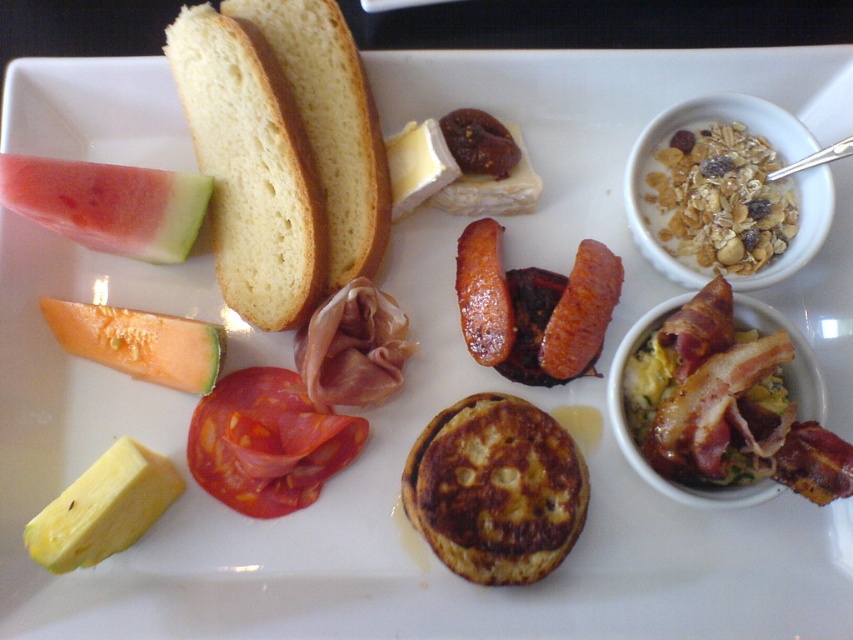
Question: Which point appears closest to the camera in this image?

Choices:
 (A) (244, 385)
 (B) (614, 292)
 (C) (287, 236)
 (D) (155, 180)

Answer: (D)

Question: Considering the real-world distances, which object is closest to the yellow butter at lower left?

Choices:
 (A) brown glazed sausage at center
 (B) sliced red tomato at center-left
 (C) golden brown crusty bread at upper left
 (D) green melon at lower left

Answer: (B)

Question: Does sliced red tomato at center-left appear over brown crispy sausage at center-right?

Choices:
 (A) yes
 (B) no

Answer: (B)

Question: Which object appears closest to the camera in this image?

Choices:
 (A) white soft bread at upper left
 (B) pink juicy watermelon at upper left
 (C) brown crispy sausage at center-right

Answer: (B)

Question: Observing the image, what is the correct spatial positioning of white soft bread at upper left in reference to brown glazed sausage at center?

Choices:
 (A) below
 (B) above

Answer: (B)

Question: Does white soft bread at upper left appear on the left side of sliced red tomato at center-left?

Choices:
 (A) yes
 (B) no

Answer: (A)